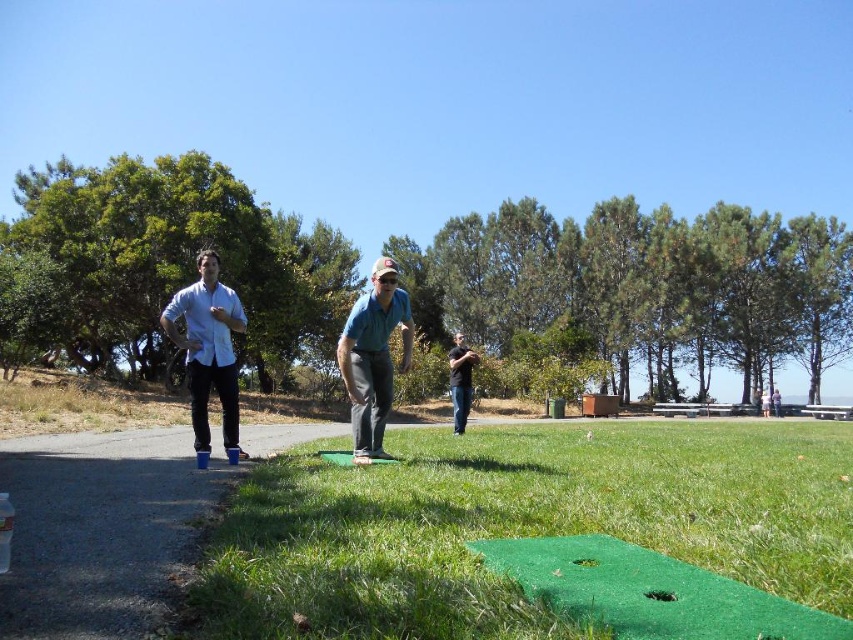
Does green artificial turf at center appear on the right side of green fabric cap at center?

Indeed, green artificial turf at center is positioned on the right side of green fabric cap at center.

How distant is green artificial turf at center from green fabric cap at center?

The distance of green artificial turf at center from green fabric cap at center is 3.84 meters.

Is point (212, 554) positioned before point (357, 394)?

Yes, it is.

Locate an element on the screen. The height and width of the screenshot is (640, 853). green artificial turf at center is located at coordinates tap(519, 525).

Can you confirm if green artificial turf at center is shorter than black matte shirt at center?

Yes, green artificial turf at center is shorter than black matte shirt at center.

Does green artificial turf at center have a smaller size compared to black matte shirt at center?

Incorrect, green artificial turf at center is not smaller in size than black matte shirt at center.

Locate an element on the screen. The width and height of the screenshot is (853, 640). green artificial turf at center is located at coordinates (519, 525).

Locate an element on the screen. This screenshot has height=640, width=853. green artificial turf at center is located at coordinates (519, 525).

In the scene shown: Is white matte shirt at center positioned at the back of black matte shirt at center?

A: No.

Who is positioned more to the right, white matte shirt at center or black matte shirt at center?

From the viewer's perspective, black matte shirt at center appears more on the right side.

Is point (212, 346) in front of point (465, 358)?

Yes, it is in front of point (465, 358).

Find the location of a particular element. Image resolution: width=853 pixels, height=640 pixels. white matte shirt at center is located at coordinates (207, 348).